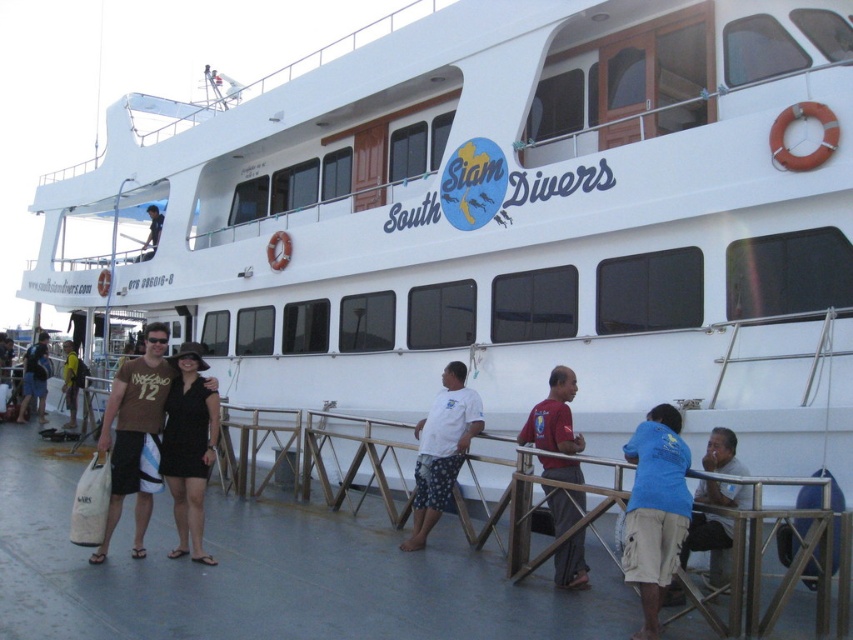
Question: Can you confirm if brown fabric bag at lower left is thinner than yellow mesh vest at center?

Choices:
 (A) yes
 (B) no

Answer: (A)

Question: Which point is closer to the camera taking this photo?

Choices:
 (A) (553, 515)
 (B) (148, 244)

Answer: (A)

Question: Which of these objects is positioned closest to the red fabric shirt at center?

Choices:
 (A) dark blue shirt at upper left
 (B) matte black dress at center

Answer: (B)

Question: Where is red fabric shirt at center located in relation to brown fabric bag at lower left in the image?

Choices:
 (A) right
 (B) left

Answer: (A)

Question: Which point is farther from the camera taking this photo?

Choices:
 (A) (26, 385)
 (B) (637, 560)
 (C) (428, 476)

Answer: (A)

Question: Does red fabric shirt at center have a larger size compared to yellow mesh vest at center?

Choices:
 (A) no
 (B) yes

Answer: (A)